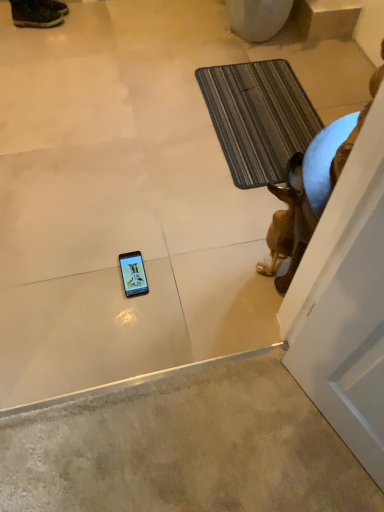
Question: From the image's perspective, is brown glossy statue at right below leather brown boot at upper left?

Choices:
 (A) no
 (B) yes

Answer: (B)

Question: Is brown glossy statue at right bigger than leather brown boot at upper left?

Choices:
 (A) yes
 (B) no

Answer: (A)

Question: Can you see brown glossy statue at right touching leather brown boot at upper left?

Choices:
 (A) yes
 (B) no

Answer: (B)

Question: Can you confirm if brown glossy statue at right is positioned to the left of leather brown boot at upper left?

Choices:
 (A) no
 (B) yes

Answer: (A)

Question: Can you confirm if brown glossy statue at right is smaller than leather brown boot at upper left?

Choices:
 (A) yes
 (B) no

Answer: (B)

Question: In terms of width, does striped fabric bath mat at upper right look wider or thinner when compared to leather brown boot at upper left?

Choices:
 (A) thin
 (B) wide

Answer: (B)

Question: Is striped fabric bath mat at upper right in front of or behind leather brown boot at upper left in the image?

Choices:
 (A) front
 (B) behind

Answer: (A)

Question: From their relative heights in the image, would you say striped fabric bath mat at upper right is taller or shorter than leather brown boot at upper left?

Choices:
 (A) tall
 (B) short

Answer: (B)

Question: Considering the positions of striped fabric bath mat at upper right and leather brown boot at upper left in the image, is striped fabric bath mat at upper right bigger or smaller than leather brown boot at upper left?

Choices:
 (A) small
 (B) big

Answer: (B)

Question: In the image, is leather brown boot at upper left on the left side or the right side of striped fabric bath mat at upper right?

Choices:
 (A) left
 (B) right

Answer: (A)

Question: Is leather brown boot at upper left wider or thinner than striped fabric bath mat at upper right?

Choices:
 (A) thin
 (B) wide

Answer: (A)

Question: Is point (48, 24) positioned closer to the camera than point (218, 136)?

Choices:
 (A) closer
 (B) farther

Answer: (B)

Question: Is leather brown boot at upper left inside or outside of striped fabric bath mat at upper right?

Choices:
 (A) outside
 (B) inside

Answer: (A)

Question: From a real-world perspective, is brown glossy statue at right physically located above or below leather brown boot at upper left?

Choices:
 (A) above
 (B) below

Answer: (A)

Question: Would you say brown glossy statue at right is to the left or to the right of leather brown boot at upper left in the picture?

Choices:
 (A) right
 (B) left

Answer: (A)